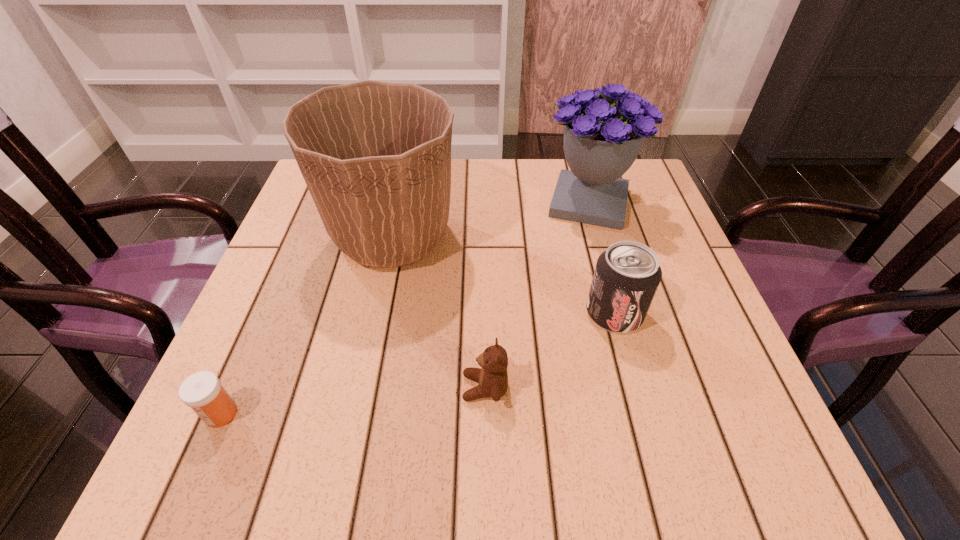
Identify the location of free space located on the back of the soda can. The height and width of the screenshot is (540, 960). (580, 188).

Find the location of a particular element. Image resolution: width=960 pixels, height=540 pixels. vacant region located 0.120m at the face of the third object from right to left is located at coordinates (391, 388).

Locate an element on the screen. free space located 0.070m at the face of the third object from right to left is located at coordinates (420, 388).

I want to click on vacant position located 0.210m at the face of the third object from right to left, so click(x=336, y=388).

Locate an element on the screen. free space located on the right of the medicine is located at coordinates (427, 414).

Locate an element on the screen. flowerpot positioned at the far edge is located at coordinates (376, 156).

Find the location of `bouquet that is positioned at the far edge`. bouquet that is positioned at the far edge is located at coordinates (601, 141).

Identify the location of object at the near edge. The width and height of the screenshot is (960, 540). (202, 391).

Locate an element on the screen. This screenshot has height=540, width=960. flowerpot located in the left edge section of the desktop is located at coordinates (376, 156).

The width and height of the screenshot is (960, 540). Identify the location of medicine positioned at the left edge. (202, 391).